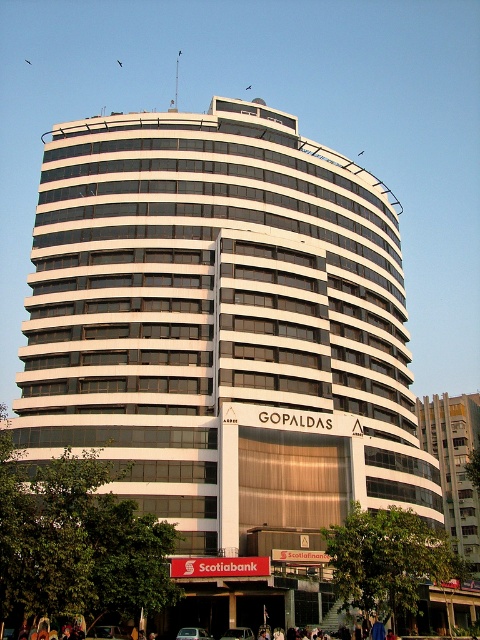
Question: Which object appears farthest from the camera in this image?

Choices:
 (A) silver metallic sedan at center
 (B) green matte car at center

Answer: (B)

Question: Which of the following is the farthest from the observer?

Choices:
 (A) green matte car at center
 (B) silver metallic sedan at center

Answer: (A)

Question: Can you confirm if silver metallic sedan at center is positioned to the left of green matte car at center?

Choices:
 (A) yes
 (B) no

Answer: (A)

Question: Is silver metallic sedan at center closer to camera compared to green matte car at center?

Choices:
 (A) no
 (B) yes

Answer: (B)

Question: Can you confirm if silver metallic sedan at center is positioned below green matte car at center?

Choices:
 (A) yes
 (B) no

Answer: (B)